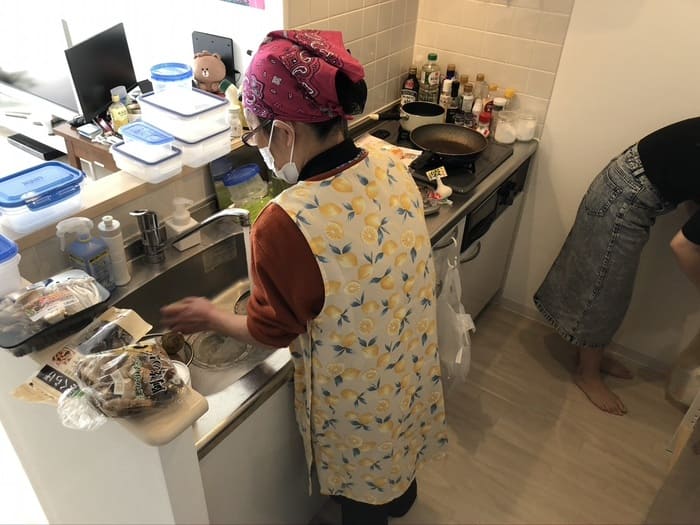
Locate an element on the screen. Image resolution: width=700 pixels, height=525 pixels. pans is located at coordinates (x=442, y=136), (x=421, y=114).